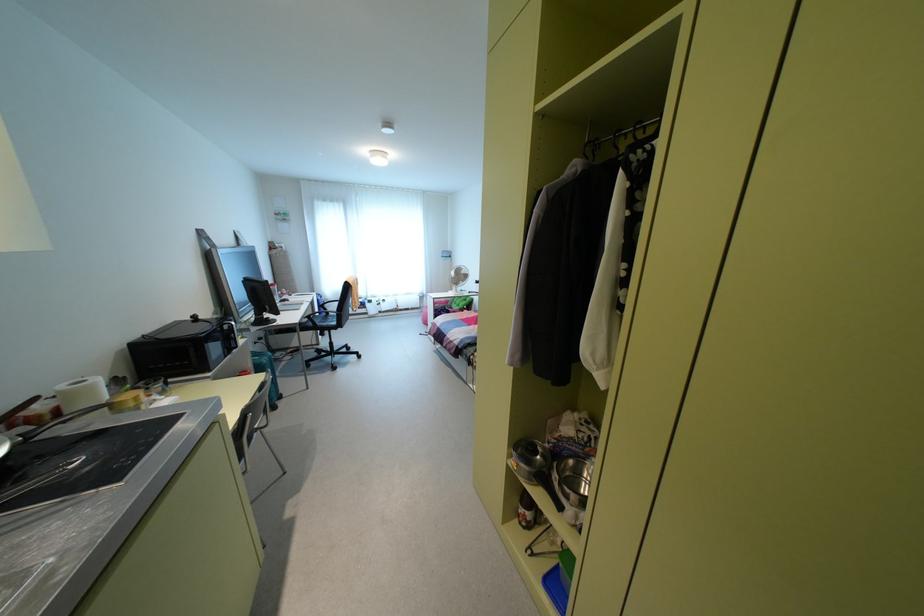
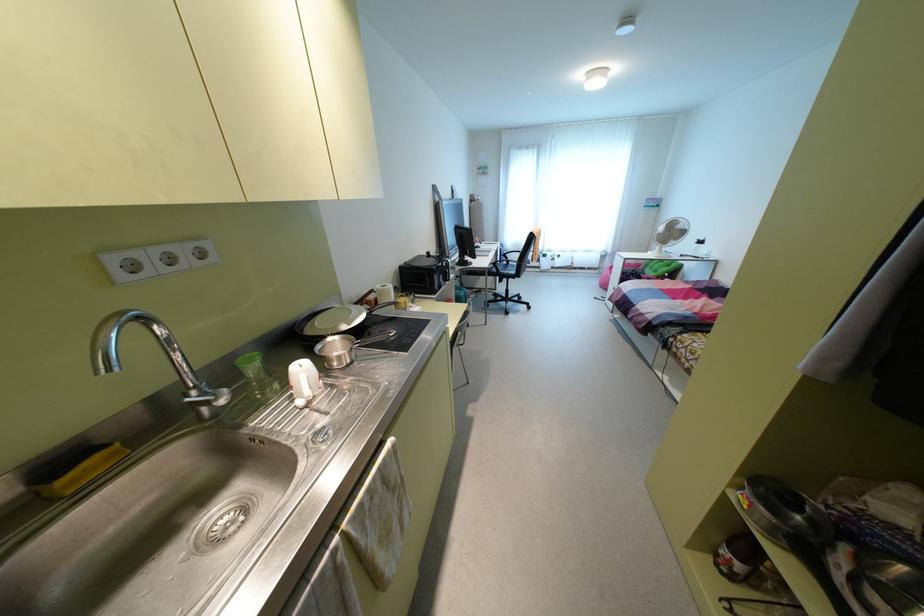
Locate, in the second image, the point that corresponds to (309,315) in the first image.

(493, 262)